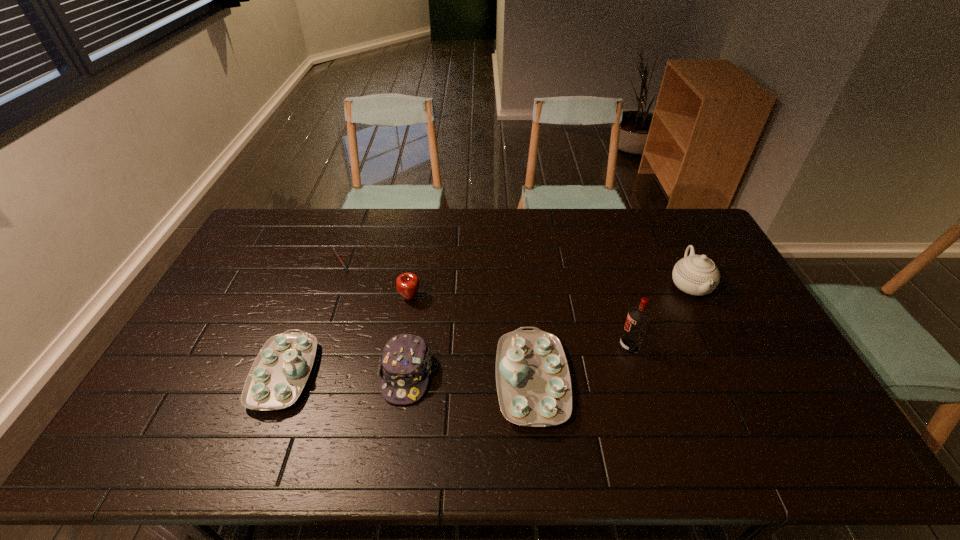
You are a GUI agent. You are given a task and a screenshot of the screen. Output one action in this format:
    pyautogui.click(x=<x>, y=<y>)
    Task: Click on the empty space between the vodka and the rightmost object
    This screenshot has width=960, height=540.
    Given the screenshot: What is the action you would take?
    pyautogui.click(x=660, y=316)

Find the location of `empty space between the second chinaware from left to right and the headwear`. empty space between the second chinaware from left to right and the headwear is located at coordinates (469, 377).

Image resolution: width=960 pixels, height=540 pixels. In order to click on the fifth closest object to the shortest chinaware in this screenshot , I will do `click(638, 318)`.

Choose which object is the third nearest neighbor to the shortest chinaware. Please provide its 2D coordinates. Your answer should be formatted as a tuple, i.e. [(x, y)], where the tuple contains the x and y coordinates of a point satisfying the conditions above.

[(336, 253)]

Where is `the closest chinaware to the shortest chinaware`? The height and width of the screenshot is (540, 960). the closest chinaware to the shortest chinaware is located at coordinates (533, 381).

At what (x,y) coordinates should I click in order to perform the action: click on chinaware that stands as the closest to the headwear. Please return your answer as a coordinate pair (x, y). Looking at the image, I should click on (533, 381).

The image size is (960, 540). Identify the location of free space that satisfies the following two spatial constraints: 1. on the back side of the apple; 2. at the nib of the shortest object. (416, 261).

You are a GUI agent. You are given a task and a screenshot of the screen. Output one action in this format:
    pyautogui.click(x=<x>, y=<y>)
    Task: Click on the vacant space that satisfies the following two spatial constraints: 1. on the front side of the third object from right to left; 2. on the right side of the apple
    The width and height of the screenshot is (960, 540).
    Given the screenshot: What is the action you would take?
    pyautogui.click(x=396, y=381)